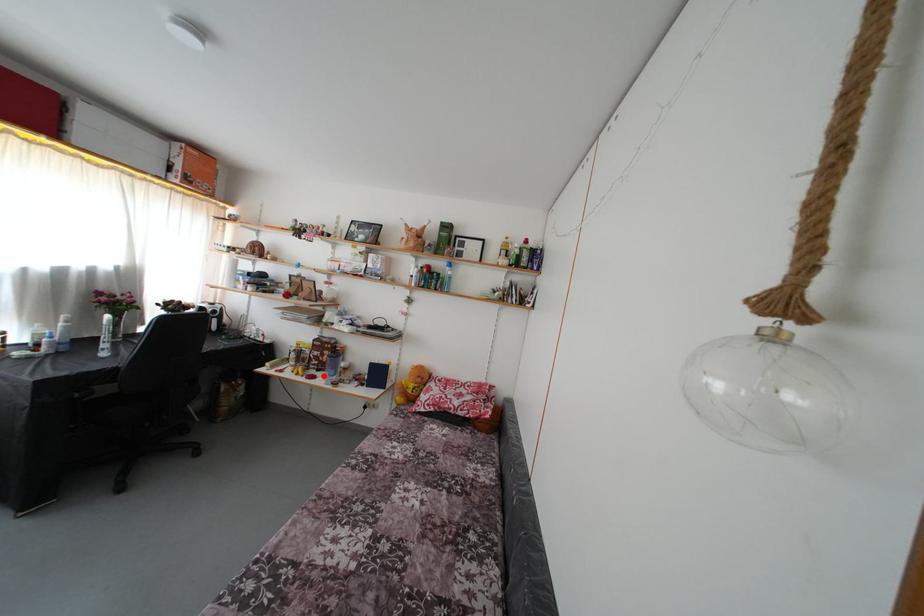
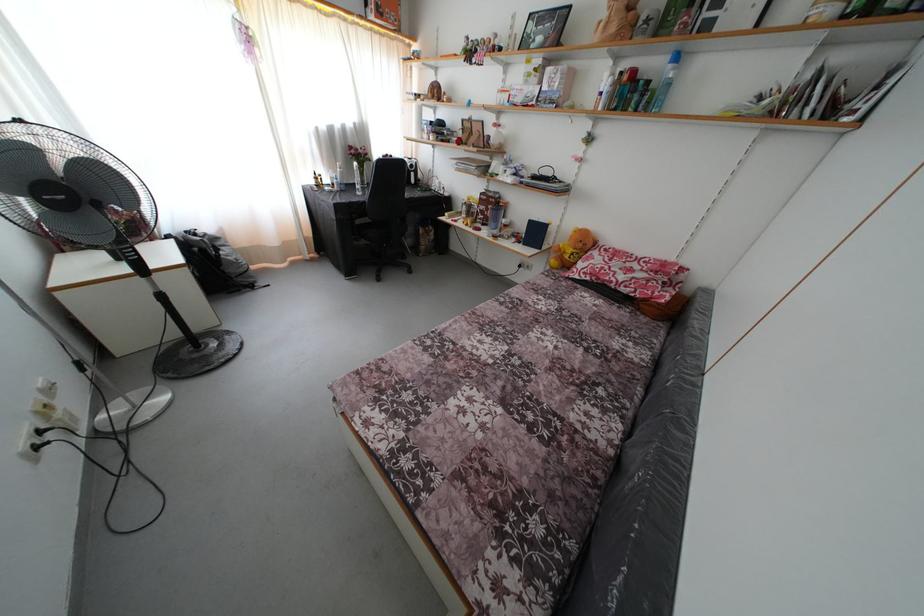
Locate, in the second image, the point that corresponds to the highlighted location in the first image.

(488, 230)